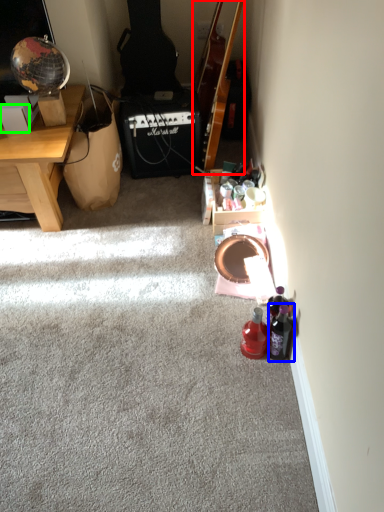
Question: Based on their relative distances, which object is farther from guitar (highlighted by a red box)? Choose from bottle (highlighted by a blue box) and box (highlighted by a green box).

Choices:
 (A) bottle
 (B) box

Answer: (A)